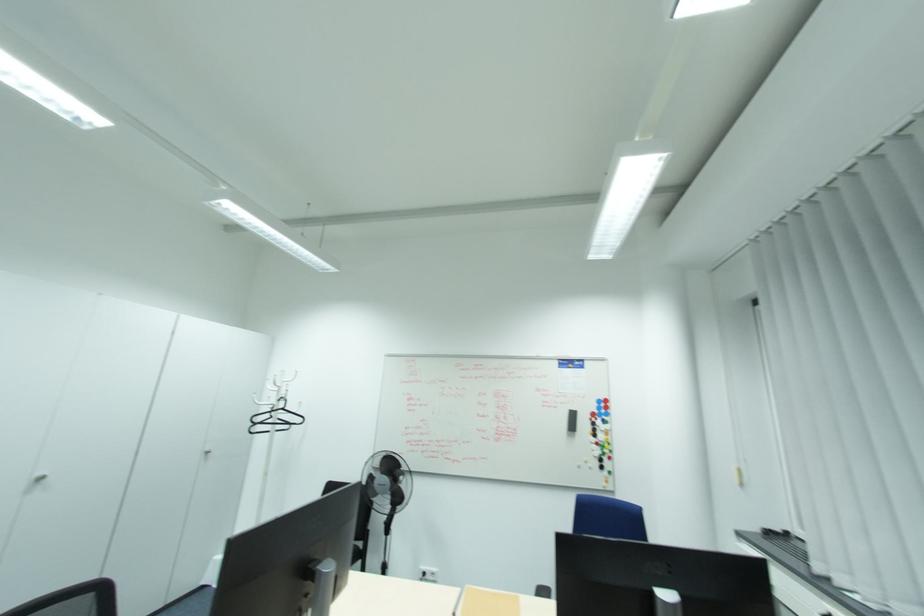
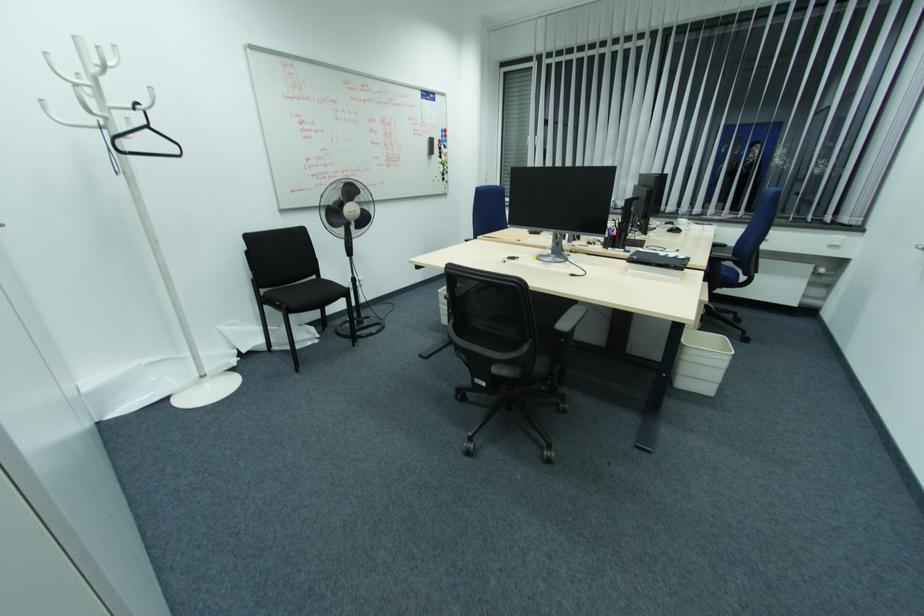
In the second image, find the point that corresponds to point (284, 398) in the first image.

(139, 105)